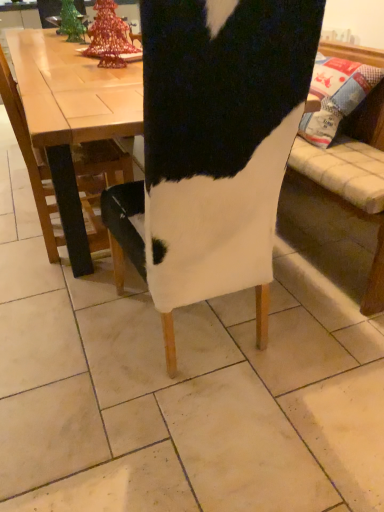
What are the coordinates of `space that is in front of white fabric chair at left, the 1th chair in the left-to-right sequence` in the screenshot? It's located at (57, 285).